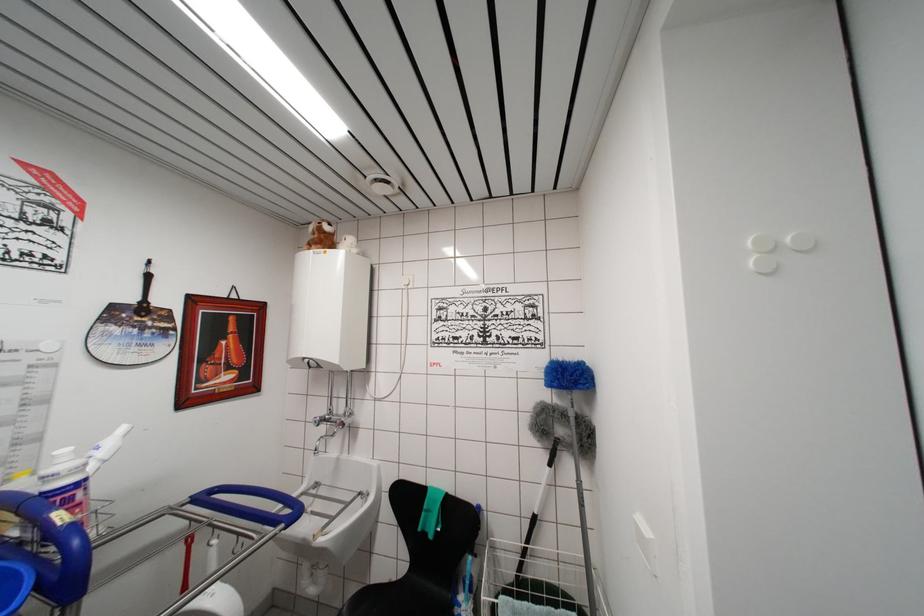
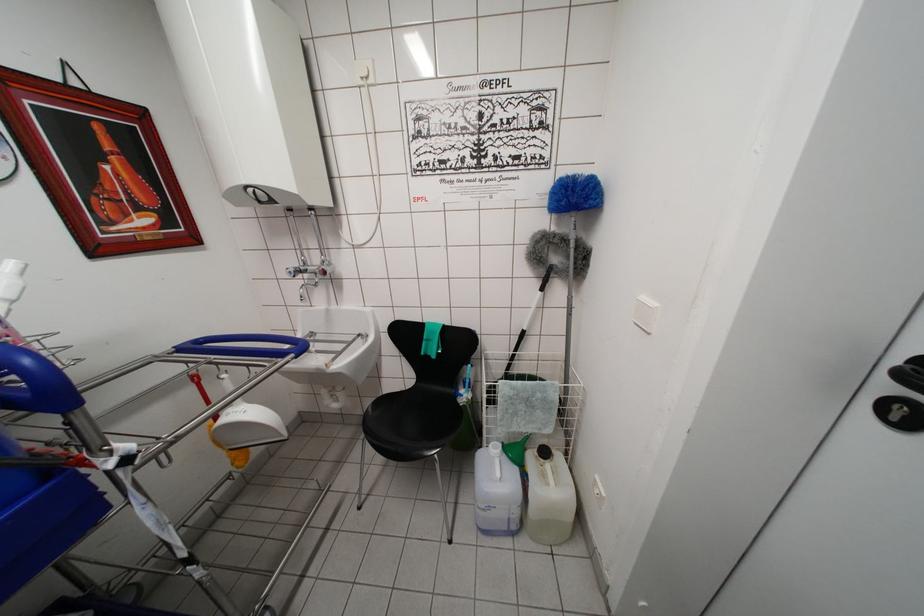
In the second image, find the point that corresponds to (x=531, y=545) in the first image.

(518, 354)